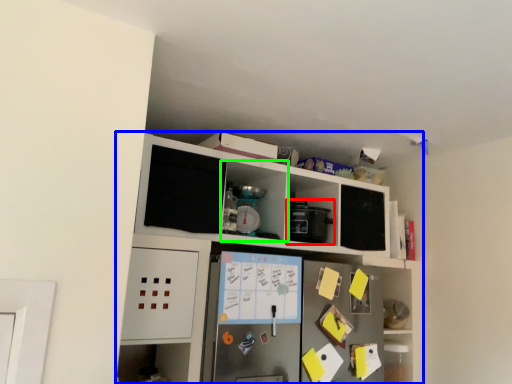
Question: Based on their relative distances, which object is nearer to appliance (highlighted by a red box)? Choose from cabinetry (highlighted by a blue box) and cabinet (highlighted by a green box).

Choices:
 (A) cabinetry
 (B) cabinet

Answer: (B)